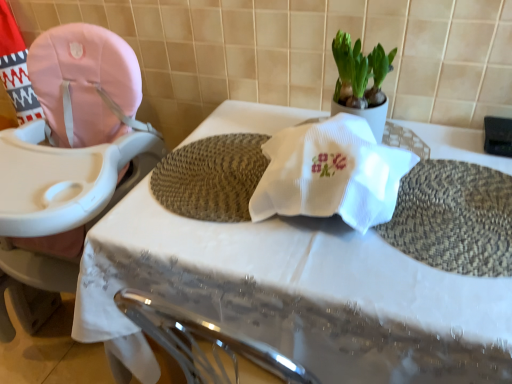
At what (x,y) coordinates should I click in order to perform the action: click on vacant region above white woven placemat at center (from a real-world perspective). Please return your answer as a coordinate pair (x, y). Looking at the image, I should click on (374, 235).